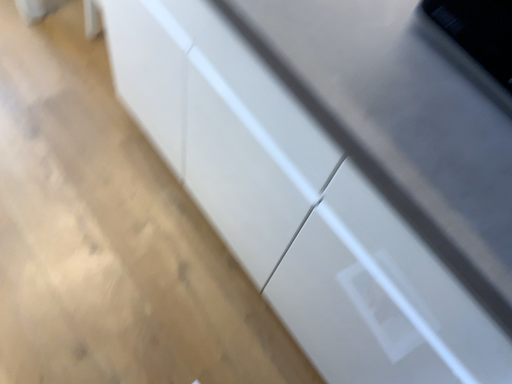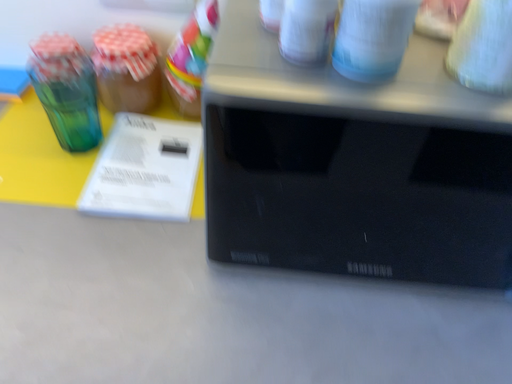
Question: Which way did the camera rotate in the video?

Choices:
 (A) rotated left
 (B) rotated right

Answer: (B)